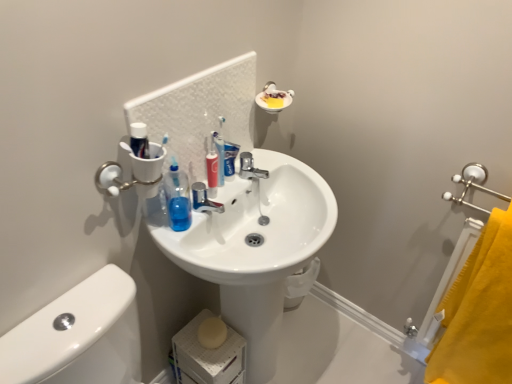
Question: From the image's perspective, is white glossy sink at center on top of translucent plastic toothbrush at center?

Choices:
 (A) no
 (B) yes

Answer: (A)

Question: Can you confirm if white glossy sink at center is smaller than translucent plastic toothbrush at center?

Choices:
 (A) yes
 (B) no

Answer: (B)

Question: Is white glossy sink at center to the left of translucent plastic toothbrush at center from the viewer's perspective?

Choices:
 (A) no
 (B) yes

Answer: (A)

Question: From a real-world perspective, is white glossy sink at center physically above translucent plastic toothbrush at center?

Choices:
 (A) yes
 (B) no

Answer: (B)

Question: Is white glossy sink at center thinner than translucent plastic toothbrush at center?

Choices:
 (A) yes
 (B) no

Answer: (B)

Question: In terms of height, does yellow fabric towel at right look taller or shorter compared to translucent plastic toothbrush at center?

Choices:
 (A) short
 (B) tall

Answer: (B)

Question: Would you say yellow fabric towel at right is inside or outside translucent plastic toothbrush at center?

Choices:
 (A) inside
 (B) outside

Answer: (B)

Question: From the image's perspective, is yellow fabric towel at right above or below translucent plastic toothbrush at center?

Choices:
 (A) above
 (B) below

Answer: (B)

Question: Looking at their shapes, would you say yellow fabric towel at right is wider or thinner than translucent plastic toothbrush at center?

Choices:
 (A) thin
 (B) wide

Answer: (B)

Question: Considering their positions, is translucent plastic toothbrush at center located in front of or behind white textured mirror at upper center?

Choices:
 (A) front
 (B) behind

Answer: (B)

Question: Looking at the image, does translucent plastic toothbrush at center seem bigger or smaller compared to white textured mirror at upper center?

Choices:
 (A) big
 (B) small

Answer: (B)

Question: Is translucent plastic toothbrush at center situated inside white textured mirror at upper center or outside?

Choices:
 (A) outside
 (B) inside

Answer: (A)

Question: Is point (218, 160) positioned closer to the camera than point (143, 104)?

Choices:
 (A) closer
 (B) farther

Answer: (B)

Question: In the image, is white glossy toothpaste at center positioned in front of or behind translucent plastic toothbrush at center?

Choices:
 (A) behind
 (B) front

Answer: (A)

Question: Considering the positions of point [227, 155] and point [209, 155], is point [227, 155] closer or farther from the camera than point [209, 155]?

Choices:
 (A) farther
 (B) closer

Answer: (A)